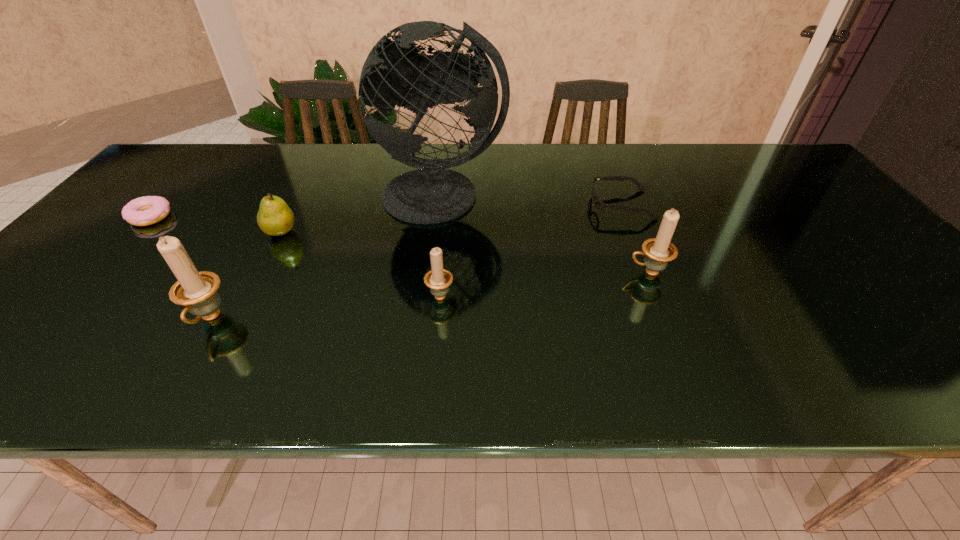
All candle_holders are currently evenly spaced. To continue this pattern, where would you add another candle_holder on the right? Please point out a vacant spot. Please provide its 2D coordinates. Your answer should be formatted as a tuple, i.e. [(x, y)], where the tuple contains the x and y coordinates of a point satisfying the conditions above.

[(836, 252)]